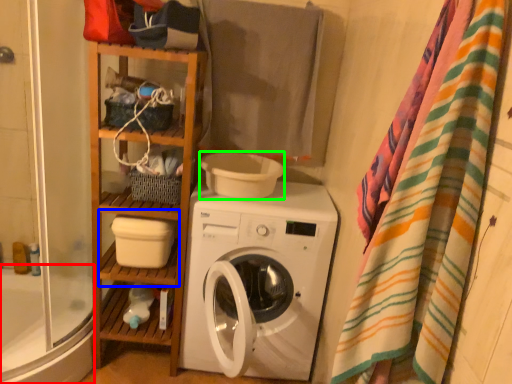
Question: Based on their relative distances, which object is nearer to bath (highlighted by a red box)? Choose from shelf (highlighted by a blue box) and toilet bowl (highlighted by a green box).

Choices:
 (A) shelf
 (B) toilet bowl

Answer: (A)